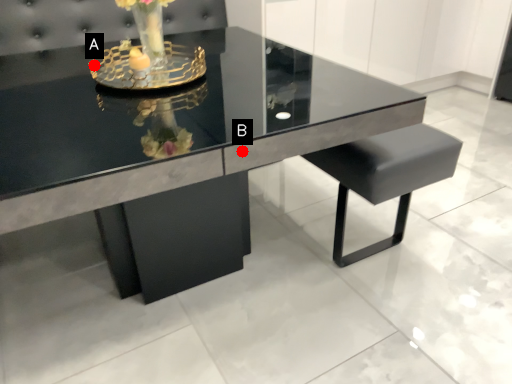
Question: Two points are circled on the image, labeled by A and B beside each circle. Which of the following is the closest to the observer?

Choices:
 (A) A is closer
 (B) B is closer

Answer: (B)